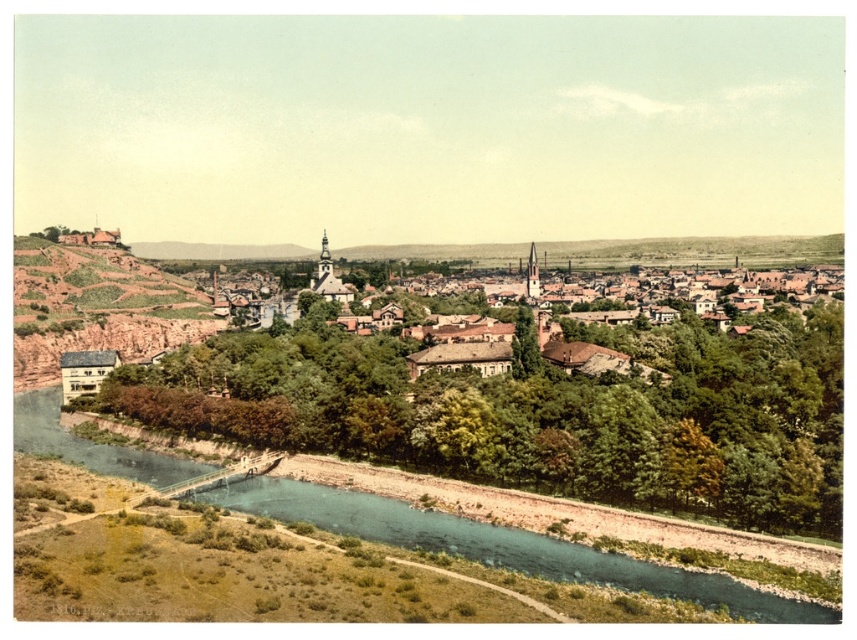
Does greenish-blue water at lower center appear on the right side of brown rocky hillside at left?

Yes, greenish-blue water at lower center is to the right of brown rocky hillside at left.

Between point (354, 529) and point (189, 292), which one is positioned in front?

Positioned in front is point (354, 529).

Identify the location of greenish-blue water at lower center. (502, 547).

Between green leafy trees at center and brown rocky hillside at left, which one has more height?

green leafy trees at center is taller.

Does green leafy trees at center appear under brown rocky hillside at left?

Correct, green leafy trees at center is located below brown rocky hillside at left.

Image resolution: width=857 pixels, height=640 pixels. Find the location of `green leafy trees at center`. green leafy trees at center is located at coordinates (534, 410).

Is point (669, 449) closer to camera compared to point (325, 499)?

That is True.

Between point (367, 374) and point (171, 460), which one is positioned in front?

Point (367, 374) is more forward.

This screenshot has height=640, width=857. I want to click on green leafy trees at center, so 534,410.